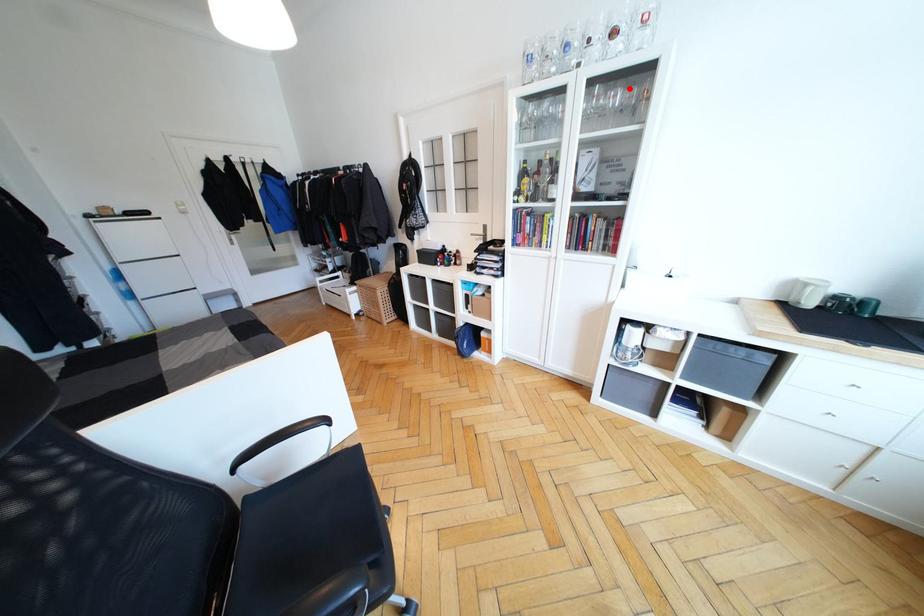
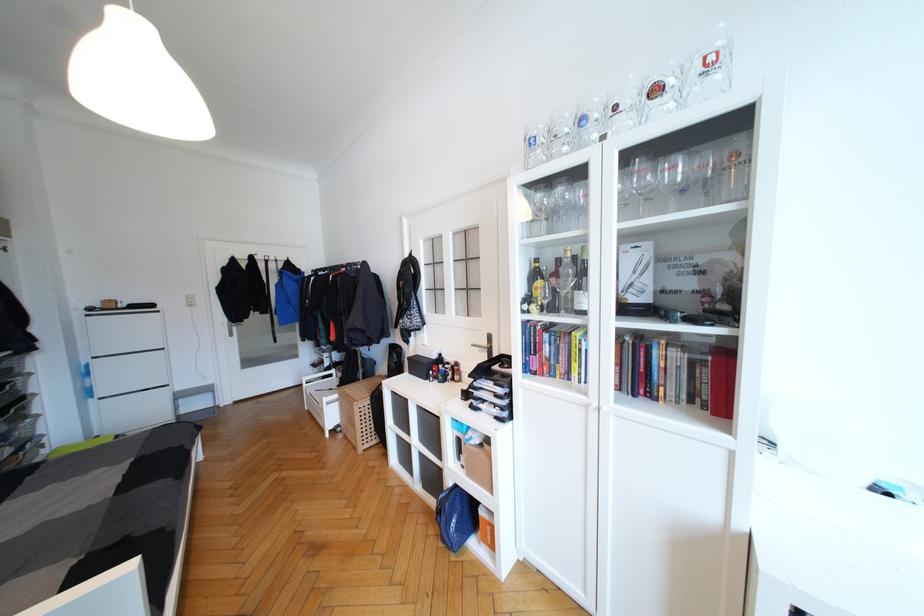
In the second image, find the point that corresponds to the highlighted location in the first image.

(694, 156)